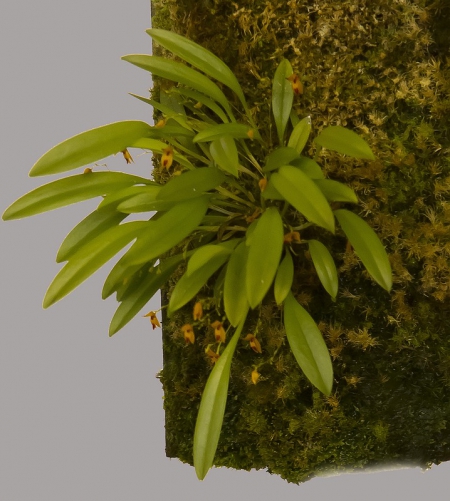
This screenshot has height=501, width=450. In order to click on bottom half of potting material in this screenshot , I will do `click(331, 469)`.